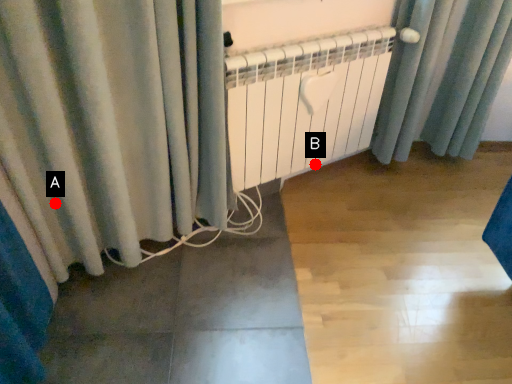
Question: Two points are circled on the image, labeled by A and B beside each circle. Which point appears farthest from the camera in this image?

Choices:
 (A) A is further
 (B) B is further

Answer: (B)